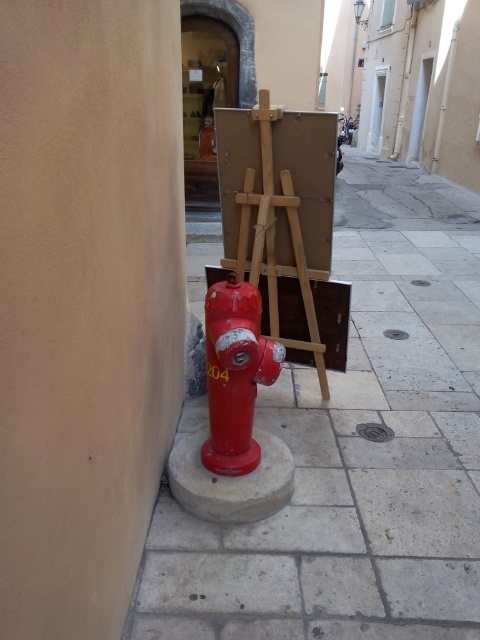
Who is taller, wooden easel at center or metallic silver extinguisher at center?

wooden easel at center is taller.

Is the position of wooden easel at center more distant than that of metallic silver extinguisher at center?

No, it is in front of metallic silver extinguisher at center.

At what (x,y) coordinates should I click in order to perform the action: click on wooden easel at center. Please return your answer as a coordinate pair (x, y). Looking at the image, I should click on (278, 205).

The height and width of the screenshot is (640, 480). Identify the location of wooden easel at center. pos(278,205).

Does wooden easel at center appear on the left side of matte red fire hydrant at center?

No, wooden easel at center is not to the left of matte red fire hydrant at center.

What are the coordinates of `wooden easel at center` in the screenshot? It's located at (278, 205).

Based on the photo, is smooth concrete pavement at center taller than metallic silver extinguisher at center?

No.

The image size is (480, 640). Describe the element at coordinates (357, 451) in the screenshot. I see `smooth concrete pavement at center` at that location.

Where is `smooth concrete pavement at center`? The width and height of the screenshot is (480, 640). smooth concrete pavement at center is located at coordinates (357, 451).

Locate an element on the screen. smooth concrete pavement at center is located at coordinates (357, 451).